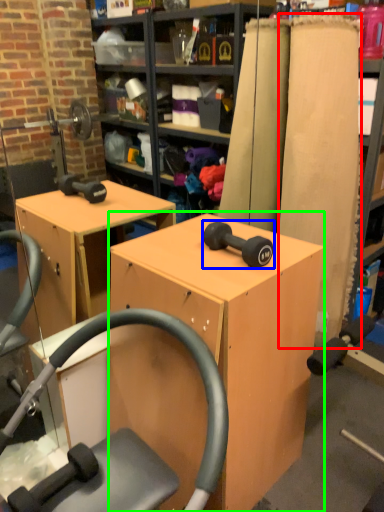
Question: Which object is positioned farthest from plank (highlighted by a red box)? Select from dumbbell (highlighted by a blue box) and furniture (highlighted by a green box).

Choices:
 (A) dumbbell
 (B) furniture

Answer: (A)